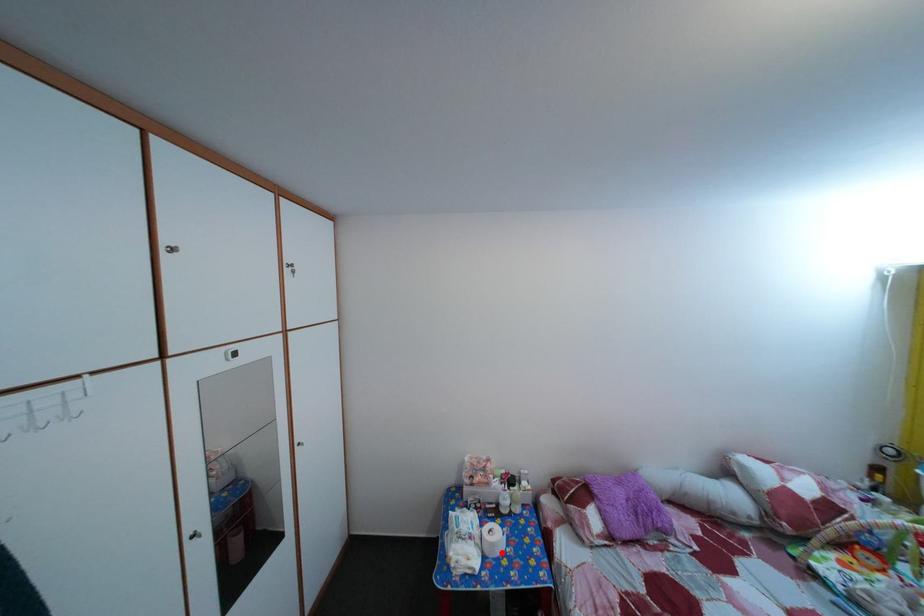
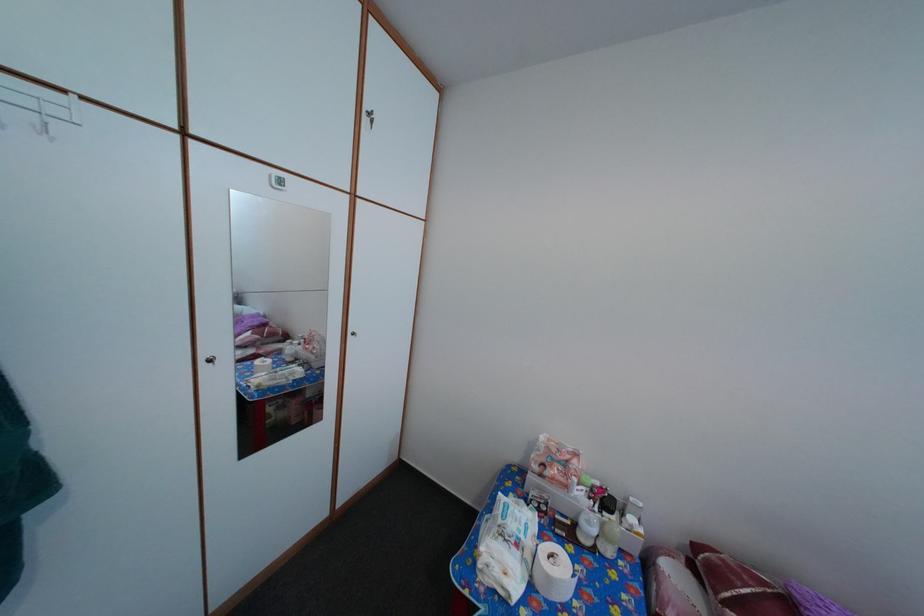
Question: I am providing you with two images of the same scene from different viewpoints. Given a red point in image1, look at the same physical point in image2. Is it:

Choices:
 (A) Closer to the viewpoint
 (B) Farther from the viewpoint

Answer: (B)